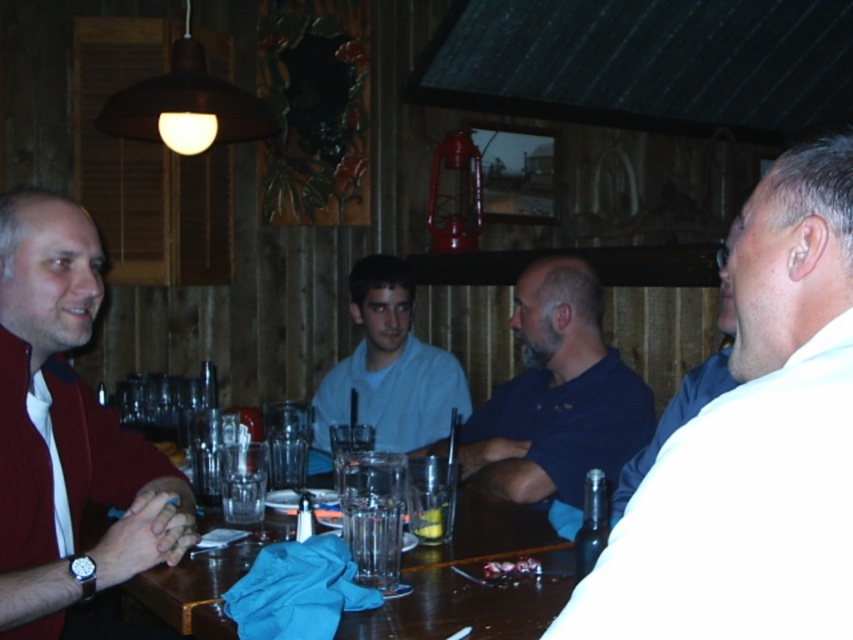
Is light blue cotton shirt at center below transparent glass at table center?

No.

Is light blue cotton shirt at center above transparent glass at table center?

Yes.

Where is `light blue cotton shirt at center`? light blue cotton shirt at center is located at coordinates (387, 369).

Is white matte shirt at right below wooden table at center?

Incorrect, white matte shirt at right is not positioned below wooden table at center.

Between white matte shirt at right and wooden table at center, which one is positioned higher?

Positioned higher is white matte shirt at right.

Does point (827, 140) come closer to viewer compared to point (444, 620)?

Yes, it is.

Image resolution: width=853 pixels, height=640 pixels. What are the coordinates of `white matte shirt at right` in the screenshot? It's located at (753, 445).

Between wooden table at center and black glass bottle at lower right, which one has less height?

wooden table at center

Who is more forward, (523, 538) or (599, 486)?

Point (599, 486) is in front.

This screenshot has height=640, width=853. Identify the location of wooden table at center. (474, 576).